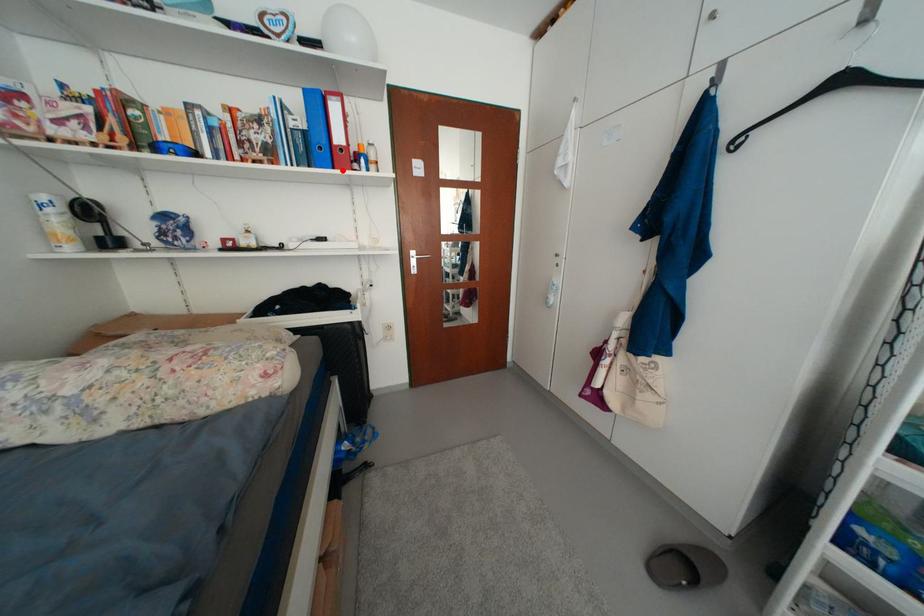
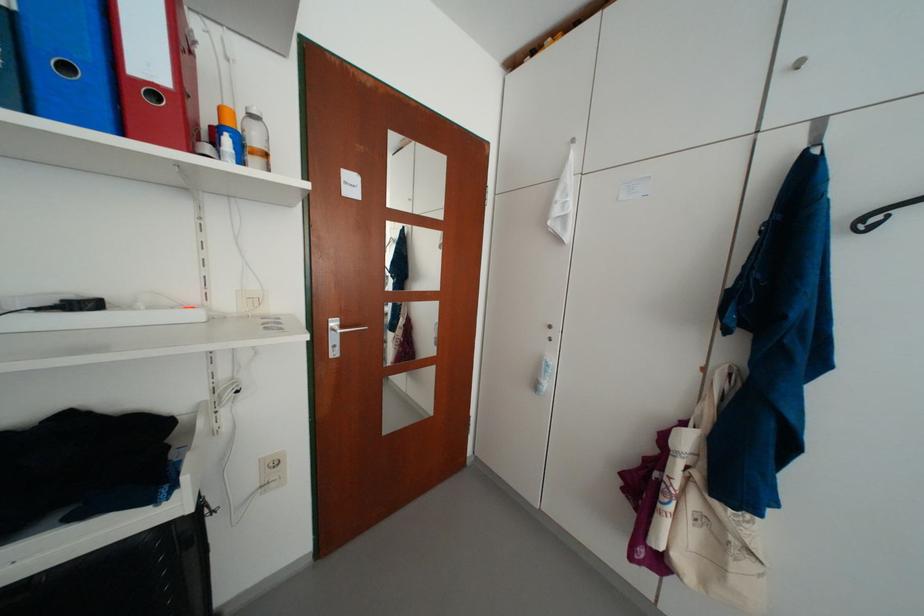
In the second image, find the point that corresponds to the highlighted location in the first image.

(130, 136)